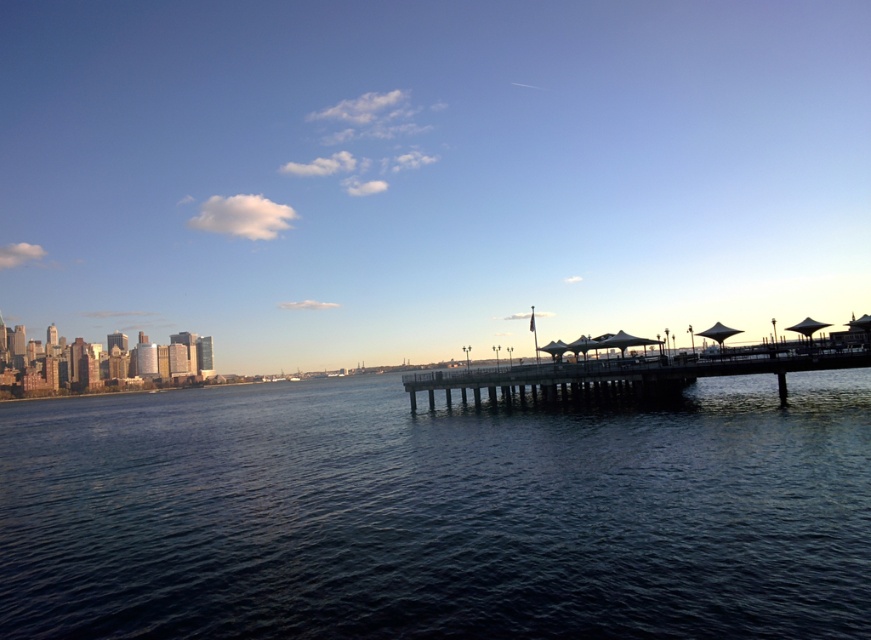
Looking at this image, you are standing on the wooden pier and see the point at coordinates (718,332). What object is this point located on?

The point at coordinates (718,332) is located on the transparent fabric umbrella at center right.